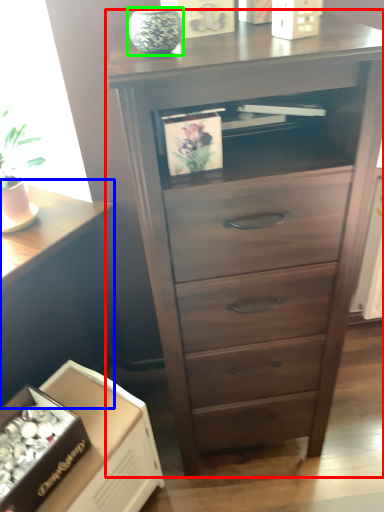
Question: Based on their relative distances, which object is nearer to chest of drawers (highlighted by a red box)? Choose from table (highlighted by a blue box) and glass vase (highlighted by a green box).

Choices:
 (A) table
 (B) glass vase

Answer: (B)